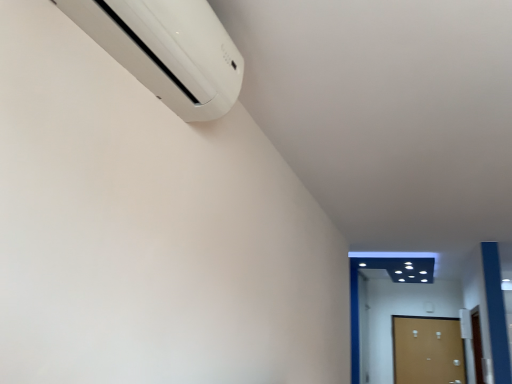
Question: Is brown matte door at lower right, marked as the 2th door in a left-to-right arrangement, to the right of wooden door at lower right, the second door positioned from the right, from the viewer's perspective?

Choices:
 (A) yes
 (B) no

Answer: (A)

Question: Is brown matte door at lower right, marked as the 2th door in a left-to-right arrangement, at the left side of wooden door at lower right, which ranks as the first door in left-to-right order?

Choices:
 (A) no
 (B) yes

Answer: (A)

Question: Could you tell me if brown matte door at lower right, marked as the 2th door in a left-to-right arrangement, is facing wooden door at lower right, the second door positioned from the right?

Choices:
 (A) no
 (B) yes

Answer: (A)

Question: Could wooden door at lower right, which ranks as the first door in left-to-right order, be considered to be inside brown matte door at lower right, marked as the 2th door in a left-to-right arrangement?

Choices:
 (A) yes
 (B) no

Answer: (B)

Question: From the image's perspective, is brown matte door at lower right, marked as the 2th door in a left-to-right arrangement, over wooden door at lower right, which ranks as the first door in left-to-right order?

Choices:
 (A) yes
 (B) no

Answer: (B)

Question: From the image's perspective, is brown matte door at lower right, which appears as the 1th door when viewed from the right, located above or below wooden door at lower right, the second door positioned from the right?

Choices:
 (A) below
 (B) above

Answer: (A)

Question: In terms of width, does brown matte door at lower right, marked as the 2th door in a left-to-right arrangement, look wider or thinner when compared to wooden door at lower right, the second door positioned from the right?

Choices:
 (A) thin
 (B) wide

Answer: (A)

Question: Is point (409, 339) positioned closer to the camera than point (364, 324)?

Choices:
 (A) closer
 (B) farther

Answer: (A)

Question: From their relative heights in the image, would you say brown matte door at lower right, which appears as the 1th door when viewed from the right, is taller or shorter than wooden door at lower right, the second door positioned from the right?

Choices:
 (A) short
 (B) tall

Answer: (A)

Question: Would you say wooden door at lower right, the second door positioned from the right, is to the left or to the right of white plastic air conditioner at upper left in the picture?

Choices:
 (A) left
 (B) right

Answer: (B)

Question: Is wooden door at lower right, which ranks as the first door in left-to-right order, wider or thinner than white plastic air conditioner at upper left?

Choices:
 (A) thin
 (B) wide

Answer: (A)

Question: From their relative heights in the image, would you say wooden door at lower right, which ranks as the first door in left-to-right order, is taller or shorter than white plastic air conditioner at upper left?

Choices:
 (A) short
 (B) tall

Answer: (B)

Question: Is wooden door at lower right, which ranks as the first door in left-to-right order, inside or outside of white plastic air conditioner at upper left?

Choices:
 (A) inside
 (B) outside

Answer: (B)

Question: Considering their positions, is brown matte door at lower right, which appears as the 1th door when viewed from the right, located in front of or behind white plastic air conditioner at upper left?

Choices:
 (A) behind
 (B) front

Answer: (A)

Question: From the image's perspective, relative to white plastic air conditioner at upper left, is brown matte door at lower right, marked as the 2th door in a left-to-right arrangement, above or below?

Choices:
 (A) above
 (B) below

Answer: (B)